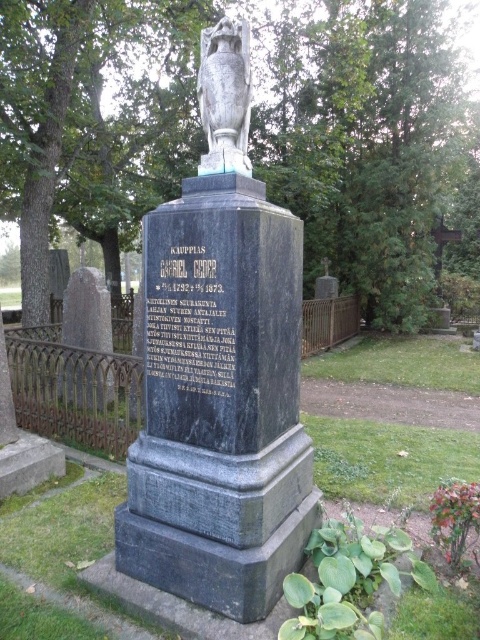
Between point (297, 262) and point (215, 109), which one is positioned in front?

Positioned in front is point (215, 109).

Can you confirm if polished gray stone monument at center is smaller than gray stone urn at center?

Incorrect, polished gray stone monument at center is not smaller in size than gray stone urn at center.

Which is in front, point (165, 442) or point (233, 77)?

Positioned in front is point (233, 77).

At what (x,y) coordinates should I click in order to perform the action: click on polished gray stone monument at center. Please return your answer as a coordinate pair (x, y). Looking at the image, I should click on (220, 372).